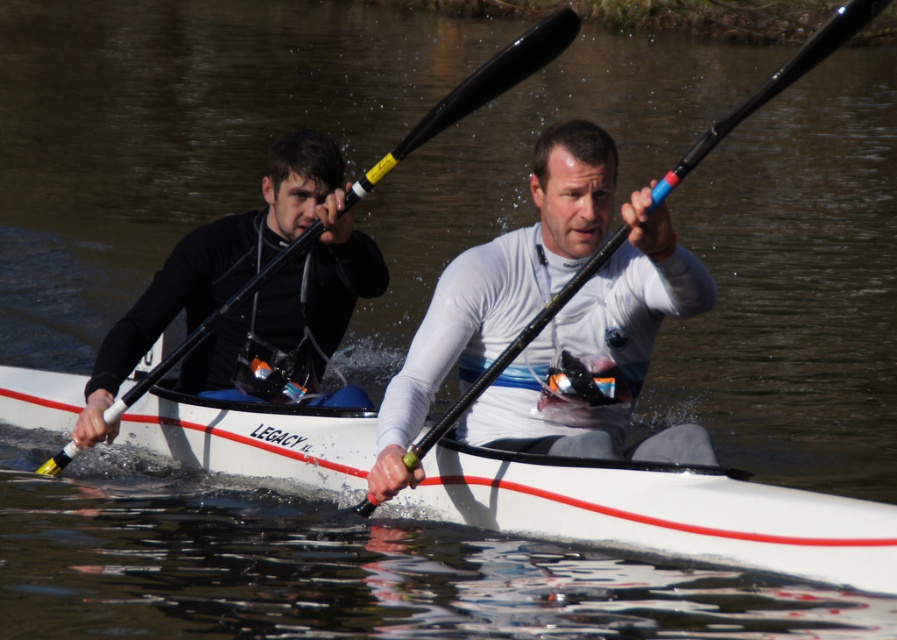
Is white matte kayak at center shorter than black plastic paddle at center?

Indeed, white matte kayak at center has a lesser height compared to black plastic paddle at center.

How distant is white matte kayak at center from black plastic paddle at center?

A distance of 3.73 feet exists between white matte kayak at center and black plastic paddle at center.

You are a GUI agent. You are given a task and a screenshot of the screen. Output one action in this format:
    pyautogui.click(x=<x>, y=<y>)
    Task: Click on the white matte kayak at center
    The height and width of the screenshot is (640, 897).
    Given the screenshot: What is the action you would take?
    pyautogui.click(x=594, y=348)

I want to click on white matte kayak at center, so click(594, 348).

Who is lower down, white plastic boat at center or black plastic paddle at center?

Positioned lower is white plastic boat at center.

Which is more to the right, white plastic boat at center or black plastic paddle at center?

Positioned to the right is white plastic boat at center.

Locate an element on the screen. white plastic boat at center is located at coordinates click(662, 513).

This screenshot has height=640, width=897. Identify the location of white plastic boat at center. (662, 513).

How distant is white plastic boat at center from white matte kayak at center?

They are 30.20 inches apart.

Who is more forward, (812, 557) or (573, 248)?

Point (812, 557) is more forward.

This screenshot has height=640, width=897. Find the location of `white plastic boat at center`. white plastic boat at center is located at coordinates (662, 513).